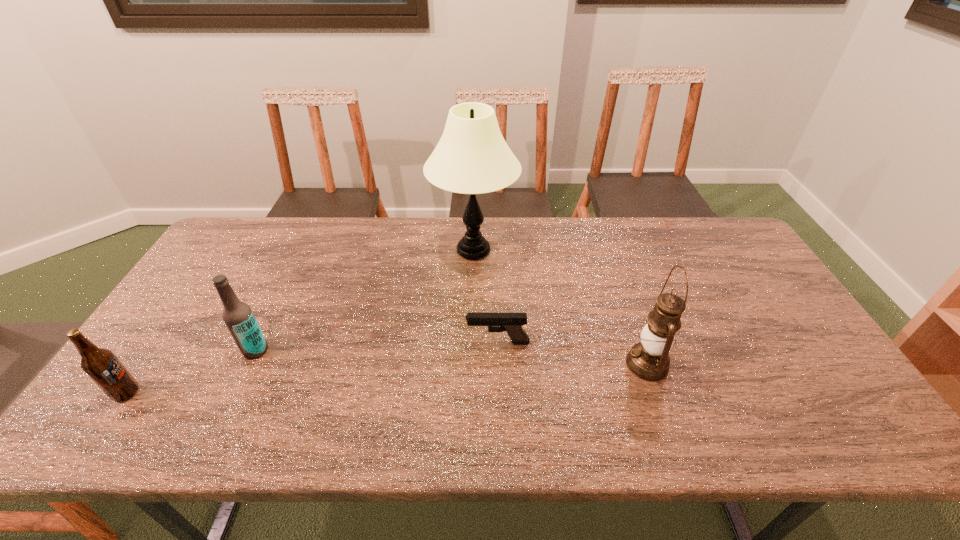
The image size is (960, 540). I want to click on the tallest object, so click(472, 157).

What are the coordinates of `lamp` in the screenshot? It's located at (472, 157).

Locate an element on the screen. This screenshot has width=960, height=540. the rightmost object is located at coordinates (648, 359).

In order to click on the second tallest object in this screenshot , I will do `click(648, 359)`.

This screenshot has width=960, height=540. In order to click on the right beer bottle in this screenshot , I will do `click(238, 316)`.

Identify the location of the farther beer bottle. (238, 316).

Where is `the left beer bottle`? Image resolution: width=960 pixels, height=540 pixels. the left beer bottle is located at coordinates (101, 365).

At what (x,y) coordinates should I click in order to perform the action: click on the shorter beer bottle. Please return your answer as a coordinate pair (x, y). Looking at the image, I should click on (101, 365).

Find the location of `pistol`. pistol is located at coordinates (512, 323).

Where is `free space located on the front of the farthest object`? The image size is (960, 540). free space located on the front of the farthest object is located at coordinates (472, 298).